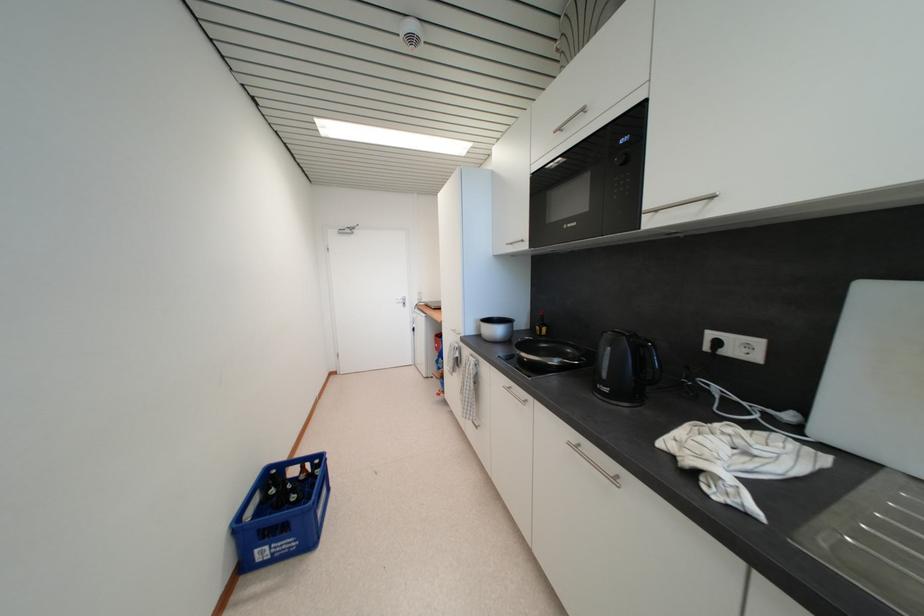
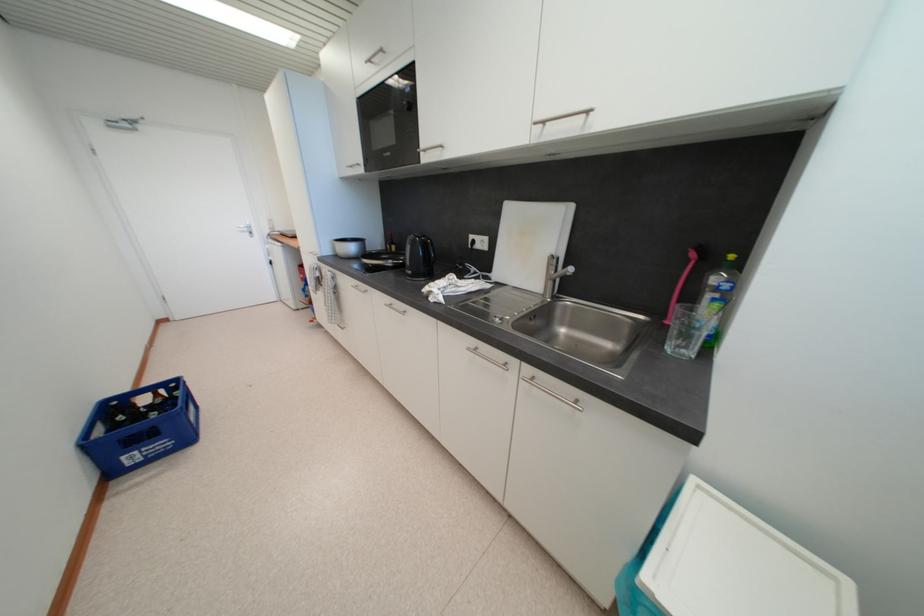
In the second image, find the point that corresponds to (513,385) in the first image.

(359, 285)